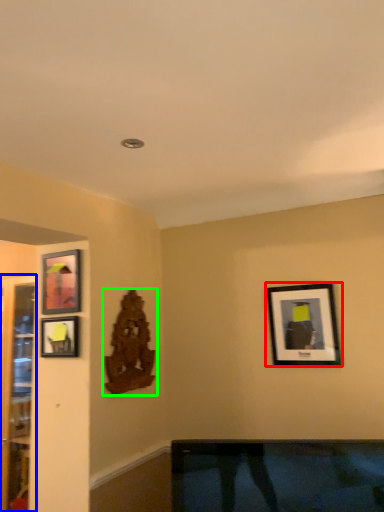
Question: Which object is the farthest from picture frame (highlighted by a red box)? Choose among these: glass door (highlighted by a blue box) or art (highlighted by a green box).

Choices:
 (A) glass door
 (B) art

Answer: (A)